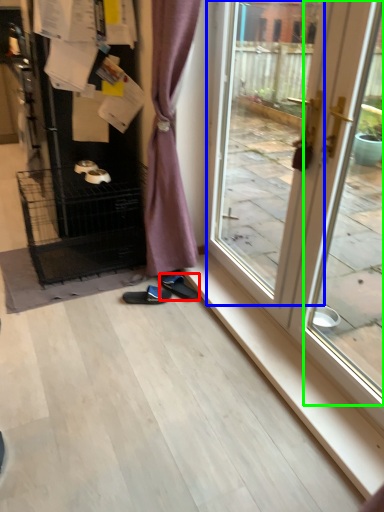
Question: Which object is the closest to the footwear (highlighted by a red box)? Choose among these: window (highlighted by a blue box) or screen door (highlighted by a green box).

Choices:
 (A) window
 (B) screen door

Answer: (A)